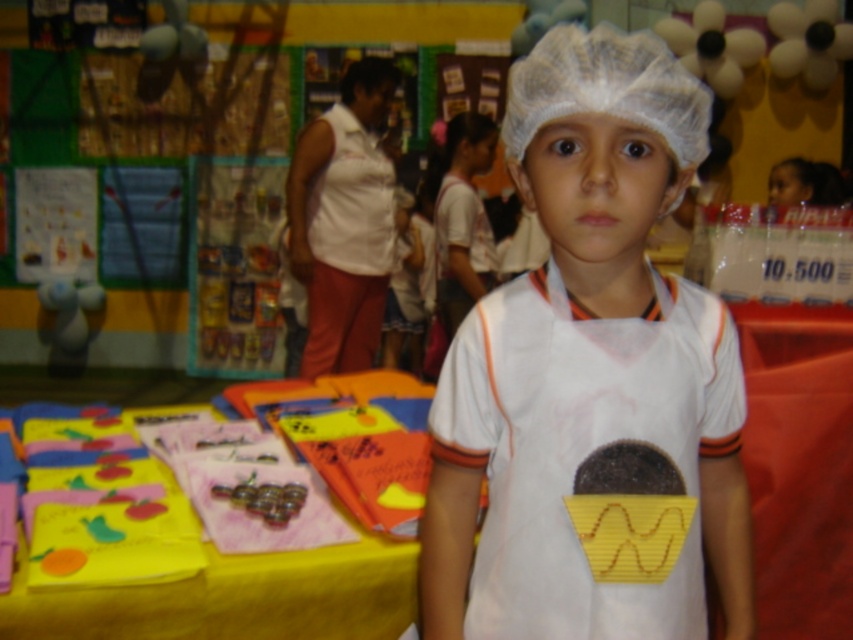
Does white matte hairnet at center appear over yellow fabric at lower left?

Yes, white matte hairnet at center is above yellow fabric at lower left.

Measure the distance between point (601, 168) and camera.

They are 33.15 inches apart.

Where is `white matte hairnet at center`? The width and height of the screenshot is (853, 640). white matte hairnet at center is located at coordinates (590, 374).

Can you confirm if white matte hairnet at center is positioned above white mesh hat at center?

Incorrect, white matte hairnet at center is not positioned above white mesh hat at center.

What do you see at coordinates (590, 374) in the screenshot? Image resolution: width=853 pixels, height=640 pixels. I see `white matte hairnet at center` at bounding box center [590, 374].

Identify the location of white matte hairnet at center. (590, 374).

Is yellow fabric at lower left taller than white mesh hat at center?

No.

Is yellow fabric at lower left bigger than white mesh hat at center?

Yes, yellow fabric at lower left is bigger than white mesh hat at center.

Between point (21, 556) and point (625, 67), which one is positioned in front?

Positioned in front is point (625, 67).

At what (x,y) coordinates should I click in order to perform the action: click on yellow fabric at lower left. Please return your answer as a coordinate pair (x, y). The image size is (853, 640). Looking at the image, I should click on (235, 596).